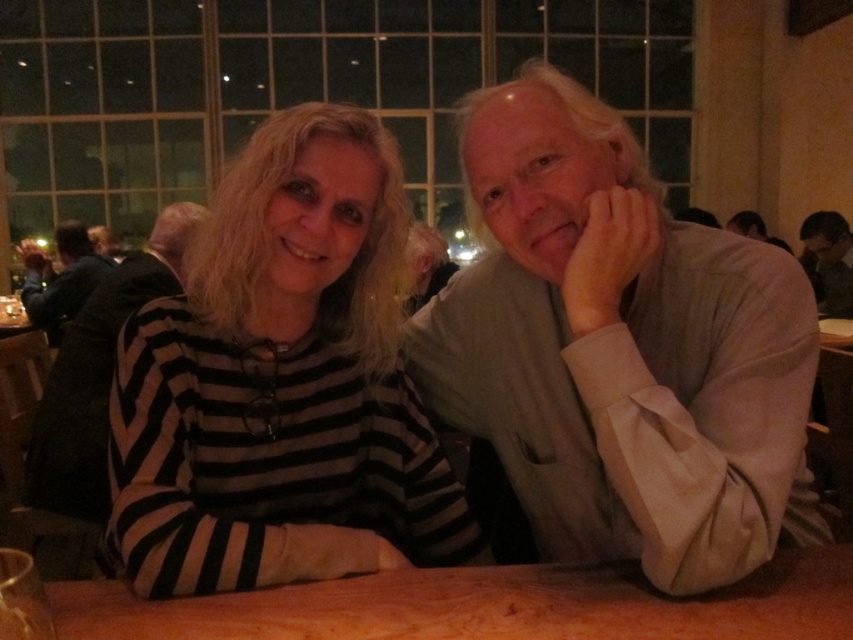
You are a tailor who needs to determine which garment requires more fabric to make between the matte gray sweater at center and the smooth gray shirt at upper right. Based on their sizes, which one would need more fabric?

The matte gray sweater at center is larger in size than the smooth gray shirt at upper right, so it would require more fabric to make.

You are sitting at the wooden table at center and want to place a book on the matte gray sweater at center. Can you reach it without moving from your seat?

The wooden table at center is to the right of the matte gray sweater at center, so you can reach the matte gray sweater at center by extending your arm to the left side of the table.

You are a fashion designer analyzing the image. You need to determine the position of the matte gray sweater at center relative to the individuals. Based on the coordinates provided, can you specify where exactly the sweater is placed in relation to the two people?

The matte gray sweater at center is located at coordinates point (97, 374), which places it centrally between the two individuals at the table.